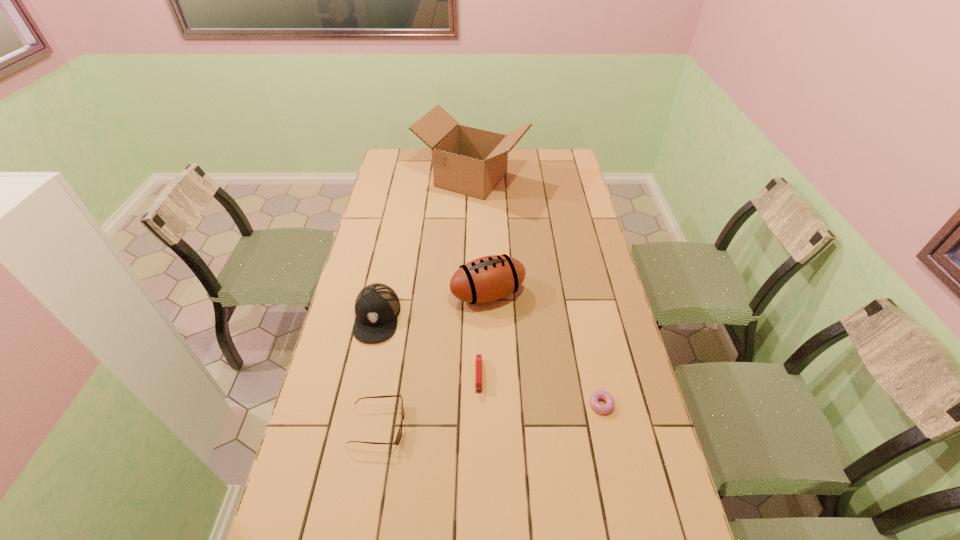
Identify the location of free area in between the rightmost object and the sunglasses. (491, 415).

At what (x,y) coordinates should I click in order to perform the action: click on object identified as the fourth closest to the cap. Please return your answer as a coordinate pair (x, y). Looking at the image, I should click on coord(469,161).

This screenshot has height=540, width=960. I want to click on object that can be found as the fifth closest to the fourth farthest object, so click(x=469, y=161).

This screenshot has height=540, width=960. I want to click on vacant space that satisfies the following two spatial constraints: 1. on the front-facing side of the rightmost object; 2. on the right side of the stapler, so click(479, 404).

Where is `free space that satisfies the following two spatial constraints: 1. on the front side of the football (American); 2. on the lenses of the sunglasses`? free space that satisfies the following two spatial constraints: 1. on the front side of the football (American); 2. on the lenses of the sunglasses is located at coordinates (491, 426).

Where is `vacant point that satisfies the following two spatial constraints: 1. on the front-facing side of the third nearest object; 2. on the lenses of the sunglasses`? The width and height of the screenshot is (960, 540). vacant point that satisfies the following two spatial constraints: 1. on the front-facing side of the third nearest object; 2. on the lenses of the sunglasses is located at coordinates (479, 426).

Locate an element on the screen. free space that satisfies the following two spatial constraints: 1. on the front-facing side of the stapler; 2. on the lenses of the sunglasses is located at coordinates (479, 426).

Locate an element on the screen. vacant area in the image that satisfies the following two spatial constraints: 1. on the front side of the rightmost object; 2. on the lenses of the sunglasses is located at coordinates (608, 426).